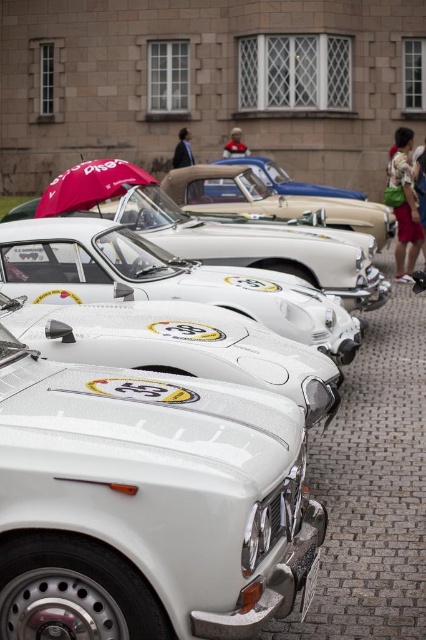
Question: Which object appears farthest from the camera in this image?

Choices:
 (A) dark fabric jacket at upper center
 (B) metallic blue car at center

Answer: (A)

Question: Which of the following is the closest to the observer?

Choices:
 (A) (275, 186)
 (B) (423, 177)
 (C) (382, 208)
 (D) (305, 600)

Answer: (D)

Question: In this image, where is white glossy car at center located relative to metallic blue car at center?

Choices:
 (A) above
 (B) below

Answer: (B)

Question: Is metallic blue car at center wider than dark blue jeans at lower right?

Choices:
 (A) yes
 (B) no

Answer: (A)

Question: Can you confirm if white metallic car at center is positioned to the left of camouflage fabric backpack at right?

Choices:
 (A) yes
 (B) no

Answer: (A)

Question: Which of the following is the farthest from the observer?

Choices:
 (A) [187, 144]
 (B) [423, 230]
 (C) [403, 180]

Answer: (A)